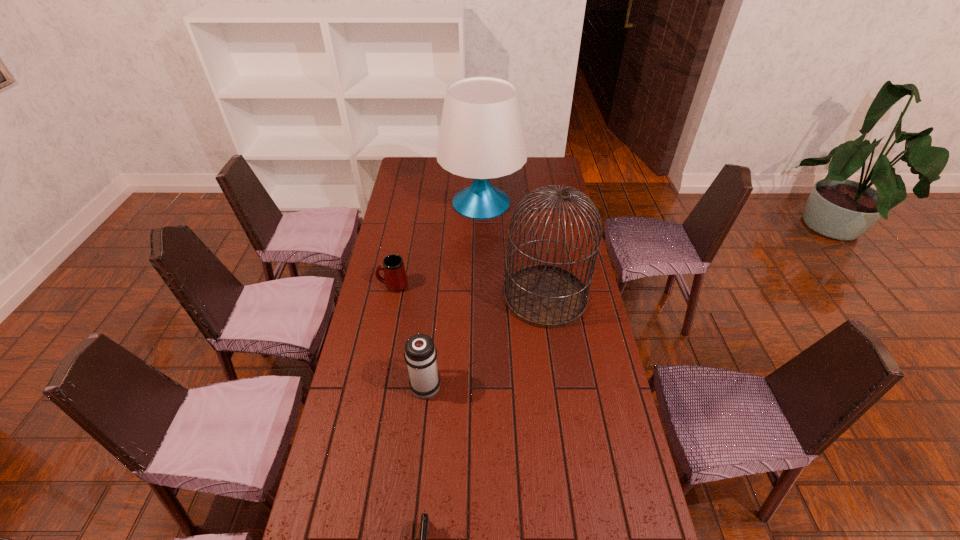
The height and width of the screenshot is (540, 960). Find the location of `vacant space located 0.230m on the side with the handle of the third tallest object`. vacant space located 0.230m on the side with the handle of the third tallest object is located at coordinates (433, 316).

The image size is (960, 540). What are the coordinates of `object located in the far edge section of the desktop` in the screenshot? It's located at (481, 136).

What are the coordinates of `object at the left edge` in the screenshot? It's located at (395, 278).

This screenshot has width=960, height=540. Find the location of `object that is at the right edge`. object that is at the right edge is located at coordinates (545, 296).

Identify the location of free location at the left edge of the desktop. (369, 399).

You are a GUI agent. You are given a task and a screenshot of the screen. Output one action in this format:
    pyautogui.click(x=<x>, y=<y>)
    Task: Click on the free point at the right edge
    
    Given the screenshot: What is the action you would take?
    pyautogui.click(x=623, y=534)

Where is `empty location between the birdcage and the third shortest object`? empty location between the birdcage and the third shortest object is located at coordinates (486, 341).

You are a GUI agent. You are given a task and a screenshot of the screen. Output one action in this format:
    pyautogui.click(x=<x>, y=<y>)
    Task: Click on the vacant region between the third tallest object and the fourth tallest object
    This screenshot has height=540, width=960.
    Given the screenshot: What is the action you would take?
    pyautogui.click(x=410, y=335)

Identify which object is located as the fourth nearest to the thermos bottle. Please provide its 2D coordinates. Your answer should be formatted as a tuple, i.e. [(x, y)], where the tuple contains the x and y coordinates of a point satisfying the conditions above.

[(481, 136)]

At what (x,y) coordinates should I click in order to perform the action: click on object that is the third closest one to the leftmost object. Please return your answer as a coordinate pair (x, y). The image size is (960, 540). Looking at the image, I should click on (545, 296).